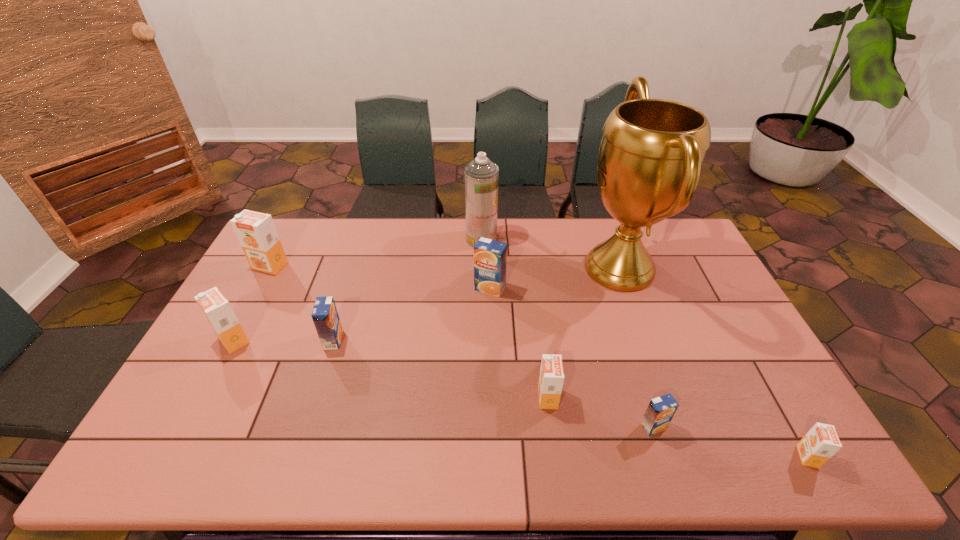
This screenshot has width=960, height=540. Find the location of `empty space that is in between the third nearest orange orange juice and the aerosol can`. empty space that is in between the third nearest orange orange juice and the aerosol can is located at coordinates (357, 289).

This screenshot has height=540, width=960. In order to click on free spot between the fourth orange juice from left to right and the farthest orange juice in this screenshot , I will do `click(380, 277)`.

I want to click on vacant area that lies between the farthest orange orange juice and the rightmost orange juice, so click(539, 361).

Identify the location of free spot between the second tallest object and the tallest object. (550, 253).

Locate an element on the screen. Image resolution: width=960 pixels, height=540 pixels. free point between the gold trophy cup and the second tallest object is located at coordinates (550, 253).

The image size is (960, 540). Identify the location of free space between the fifth orange juice from right to left and the eighth shortest object. tap(407, 289).

Locate an element on the screen. Image resolution: width=960 pixels, height=540 pixels. empty location between the third object from left to right and the smallest blue orange_juice is located at coordinates (493, 383).

You are a GUI agent. You are given a task and a screenshot of the screen. Output one action in this format:
    pyautogui.click(x=<x>, y=<y>)
    Task: Click on the fourth closest object to the second biggest orange orange juice
    This screenshot has height=540, width=960.
    Given the screenshot: What is the action you would take?
    pos(481,176)

Identify which object is the closest to the farthest orange juice. Please provide its 2D coordinates. Your answer should be formatted as a tuple, i.e. [(x, y)], where the tuple contains the x and y coordinates of a point satisfying the conditions above.

[(216, 308)]

Select which orange juice is the sixth closest to the aerosol can. Please provide its 2D coordinates. Your answer should be formatted as a tuple, i.e. [(x, y)], where the tuple contains the x and y coordinates of a point satisfying the conditions above.

[(660, 411)]